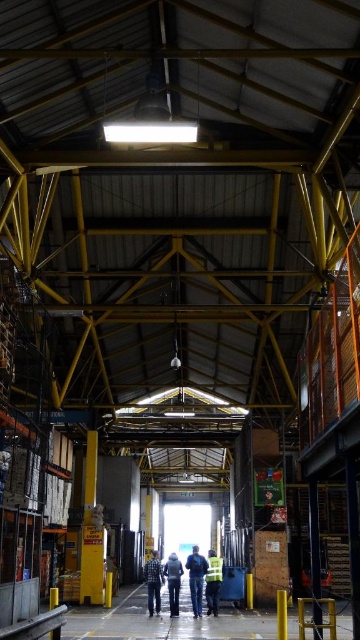
Question: Does reflective yellow vest at center have a larger size compared to denim jacket at center?

Choices:
 (A) no
 (B) yes

Answer: (A)

Question: Does blue denim jeans at center have a lesser width compared to denim jacket at center?

Choices:
 (A) yes
 (B) no

Answer: (A)

Question: Can you confirm if yellow matte pillar at center is positioned to the left of denim jacket at center?

Choices:
 (A) yes
 (B) no

Answer: (A)

Question: Among these points, which one is farthest from the camera?

Choices:
 (A) (91, 486)
 (B) (214, 608)

Answer: (A)

Question: Which object is farther from the camera taking this photo?

Choices:
 (A) reflective yellow vest at center
 (B) denim pants at center

Answer: (A)

Question: Among these objects, which one is nearest to the camera?

Choices:
 (A) blue denim jeans at center
 (B) reflective yellow vest at center
 (C) denim pants at center
 (D) denim jacket at center

Answer: (A)